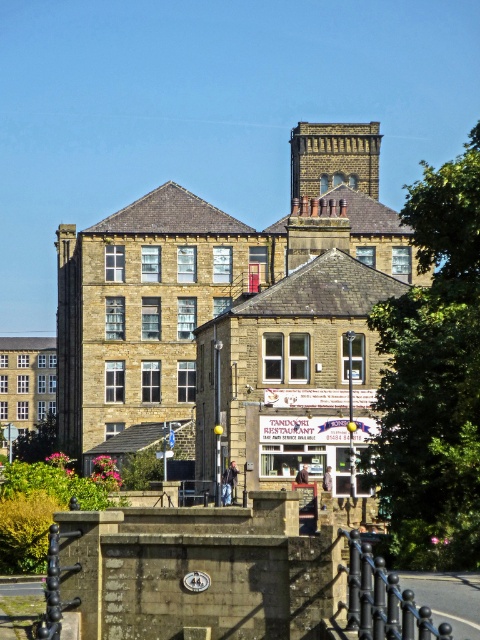
You are a tourist standing in front of the historic stone building and want to take a photo of both the black metal railing at lower center and the brown stone bell tower at upper center. Which object should you focus on first to ensure both are in the frame?

You should focus on the brown stone bell tower at upper center first because it is larger than the black metal railing at lower center, so it will take up more space in the frame and ensure both are included.